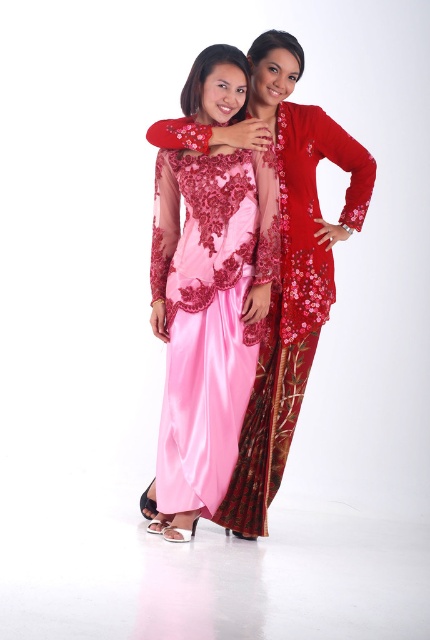
Who is shorter, satin pink dress at center or velvet red robe at center?

Standing shorter between the two is velvet red robe at center.

Image resolution: width=430 pixels, height=640 pixels. Describe the element at coordinates (202, 326) in the screenshot. I see `satin pink dress at center` at that location.

This screenshot has width=430, height=640. In order to click on satin pink dress at center in this screenshot , I will do `click(202, 326)`.